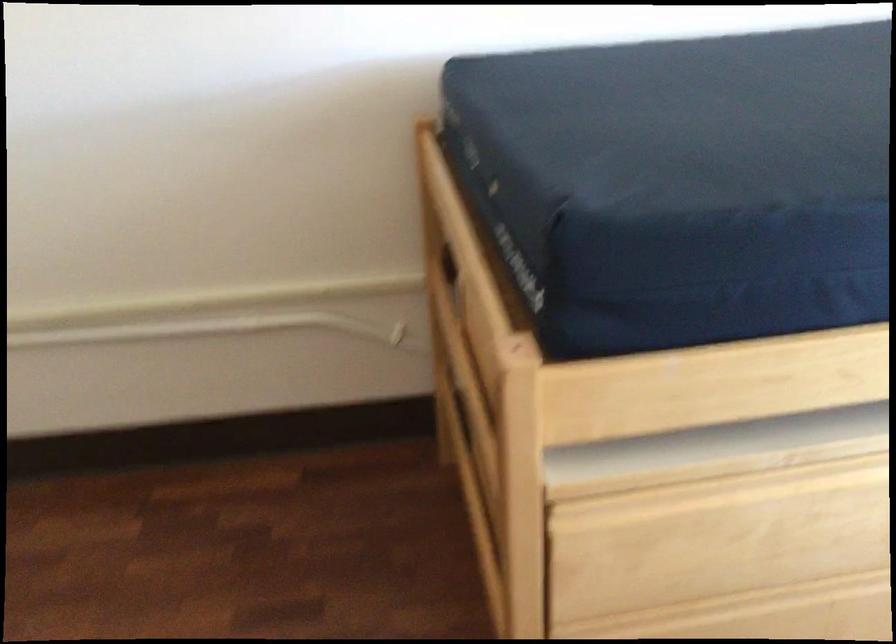
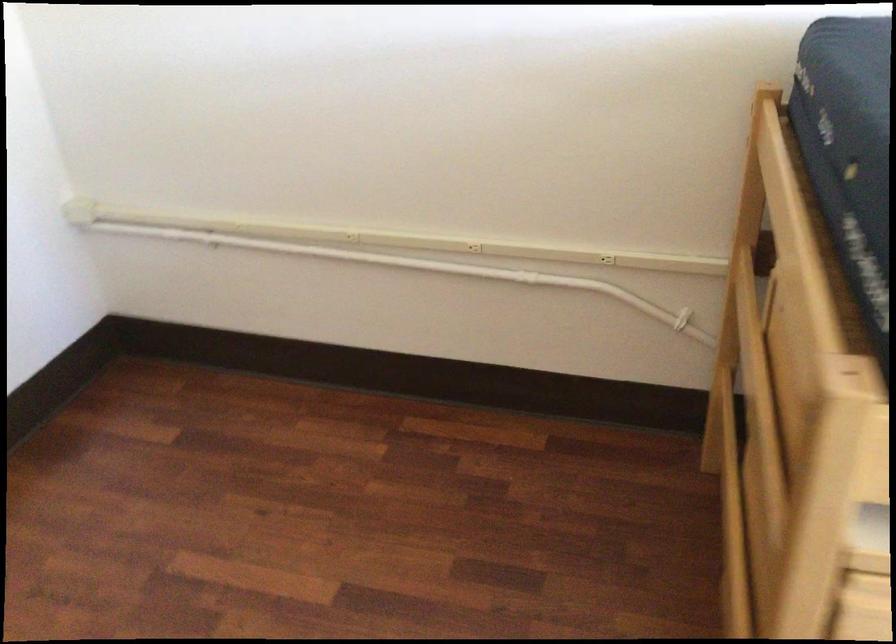
Question: The camera is either moving clockwise (left) or counter-clockwise (right) around the object. The first image is from the beginning of the video and the second image is from the end. Is the camera moving left or right when shooting the video?

Choices:
 (A) Left
 (B) Right

Answer: (B)